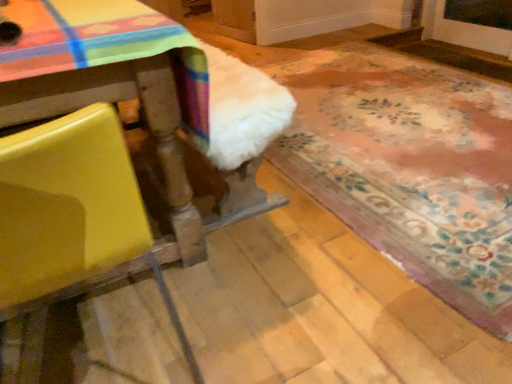
The height and width of the screenshot is (384, 512). Find the location of `vacant region under yellow matte chair at left (from a real-world perspective)`. vacant region under yellow matte chair at left (from a real-world perspective) is located at coordinates (97, 348).